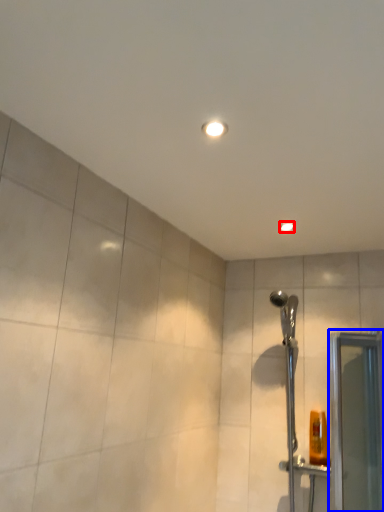
Question: Which object is closer to the camera taking this photo, light fixture (highlighted by a red box) or screen door (highlighted by a blue box)?

Choices:
 (A) light fixture
 (B) screen door

Answer: (B)